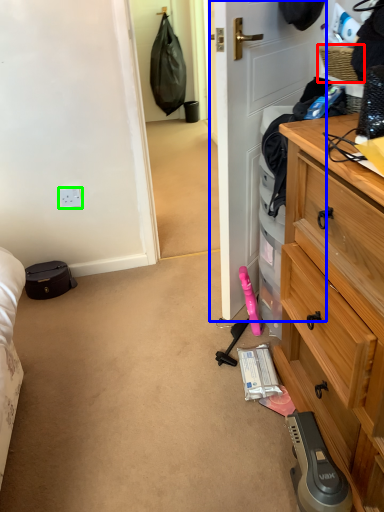
Question: Based on their relative distances, which object is farther from picnic basket (highlighted by a red box)? Choose from door (highlighted by a blue box) and power outlet (highlighted by a green box).

Choices:
 (A) door
 (B) power outlet

Answer: (B)